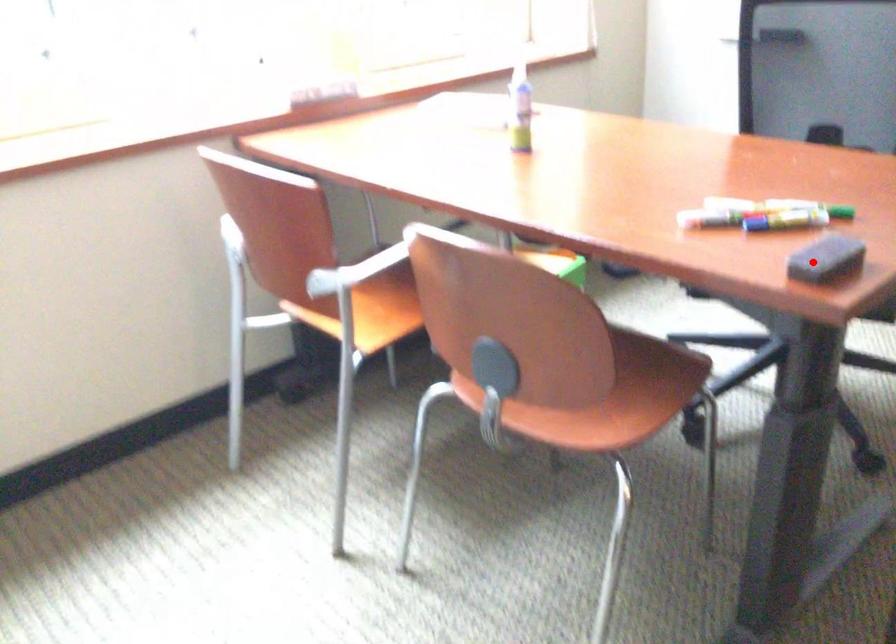
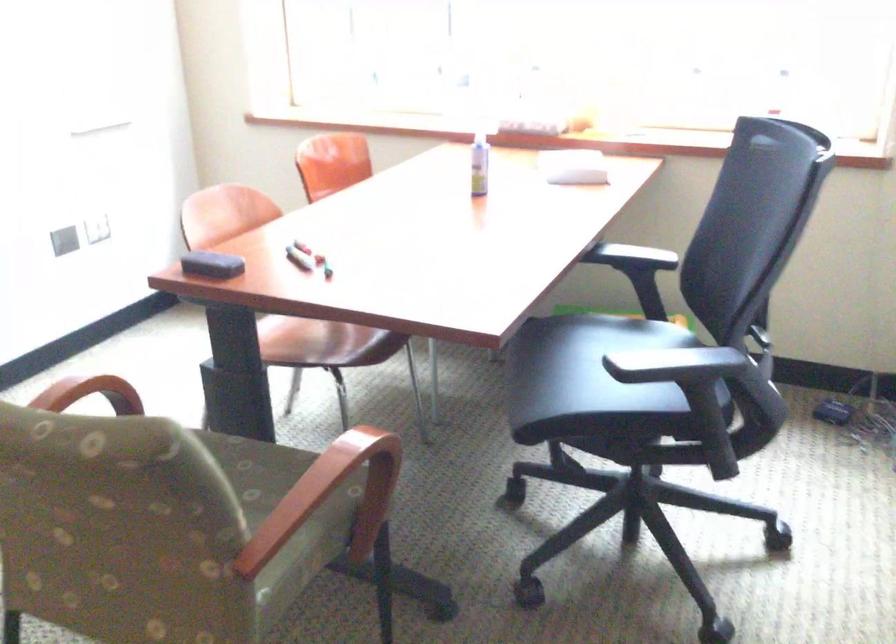
In the second image, find the point that corresponds to the highlighted location in the first image.

(211, 265)